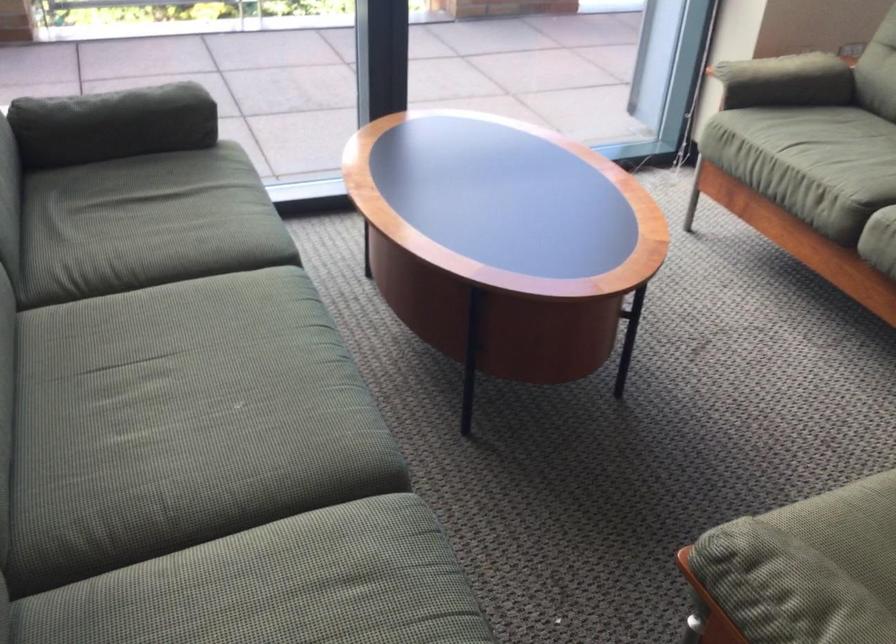
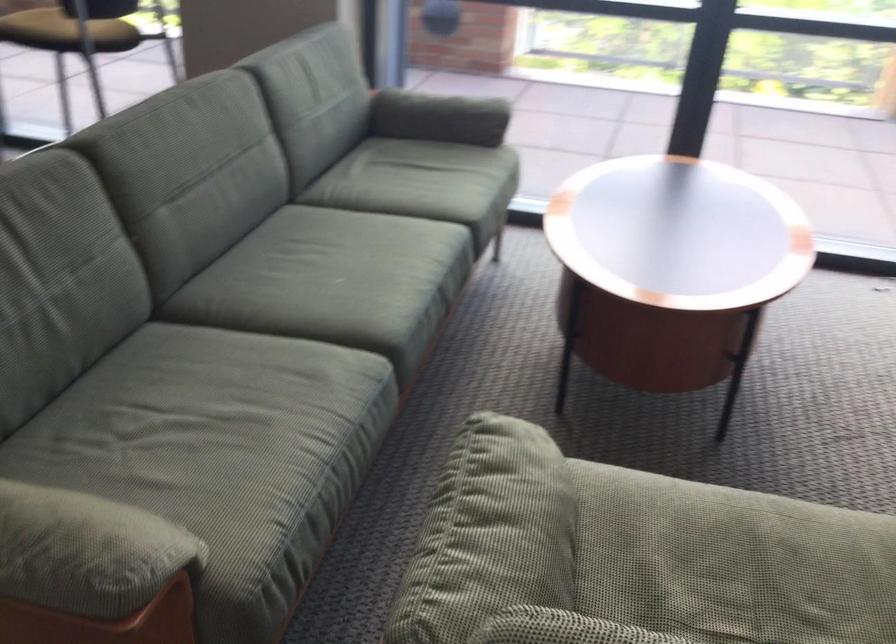
Question: Based on the continuous images, in which direction is the camera rotating? Reply with the corresponding letter.

Choices:
 (A) Left
 (B) Right
 (C) Up
 (D) Down

Answer: (A)